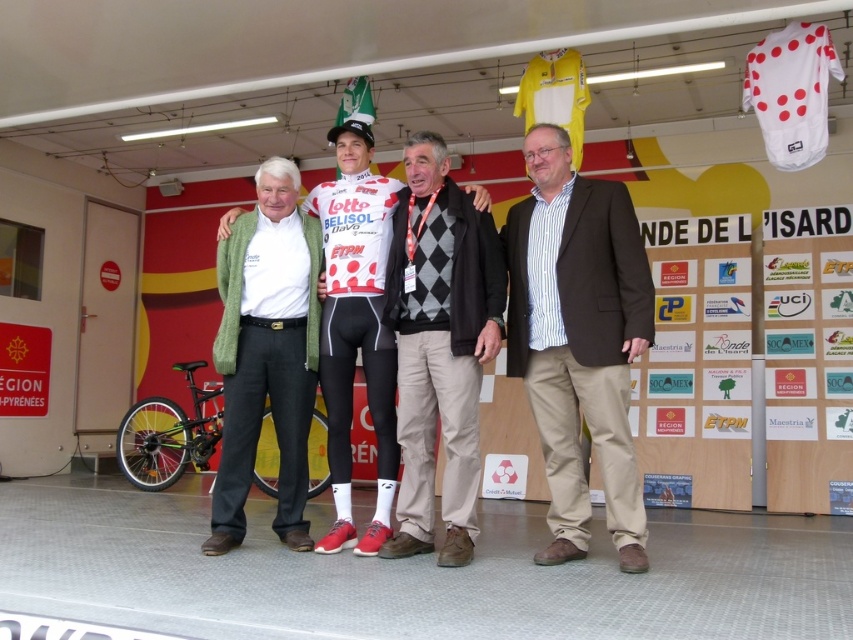
Is white jersey at center positioned behind shiny black bicycle at lower left?

No, it is in front of shiny black bicycle at lower left.

Is white jersey at center bigger than shiny black bicycle at lower left?

No.

Is point (390, 198) more distant than point (312, 442)?

No.

Identify the location of white jersey at center. (357, 324).

Measure the distance between point (577, 442) and camera.

They are 4.25 meters apart.

Does point (521, 323) come behind point (161, 484)?

No, it is in front of (161, 484).

The image size is (853, 640). In order to click on brown textured blazer at center in this screenshot , I will do `click(578, 339)`.

Is brown textured blazer at center smaller than green wool sweater at left?

Incorrect, brown textured blazer at center is not smaller in size than green wool sweater at left.

Is brown textured blazer at center to the left of green wool sweater at left from the viewer's perspective?

No, brown textured blazer at center is not to the left of green wool sweater at left.

Between point (521, 262) and point (239, 355), which one is positioned behind?

Point (239, 355)

Where is `brown textured blazer at center`? brown textured blazer at center is located at coordinates (578, 339).